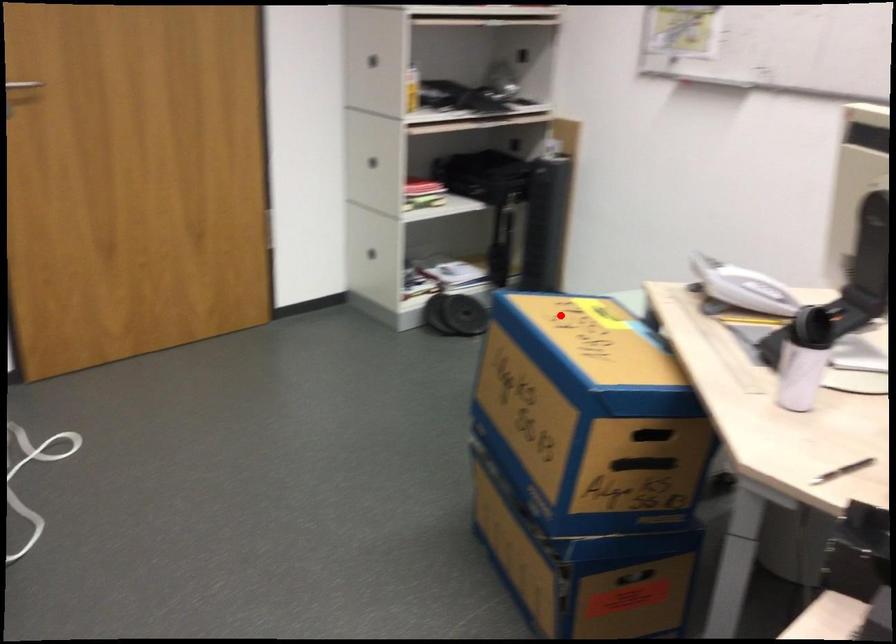
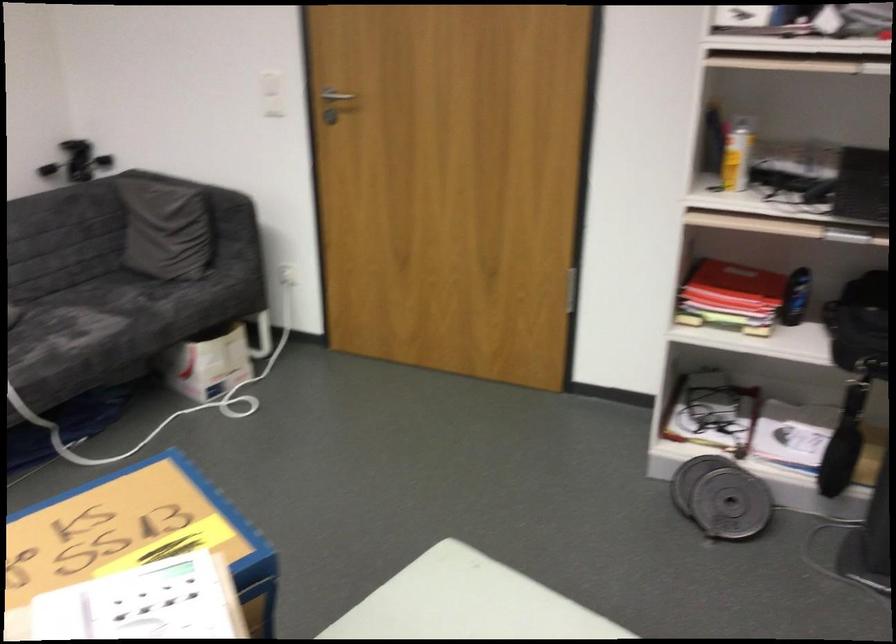
Find the pixel in the second image that matches the highlighted location in the first image.

(139, 535)